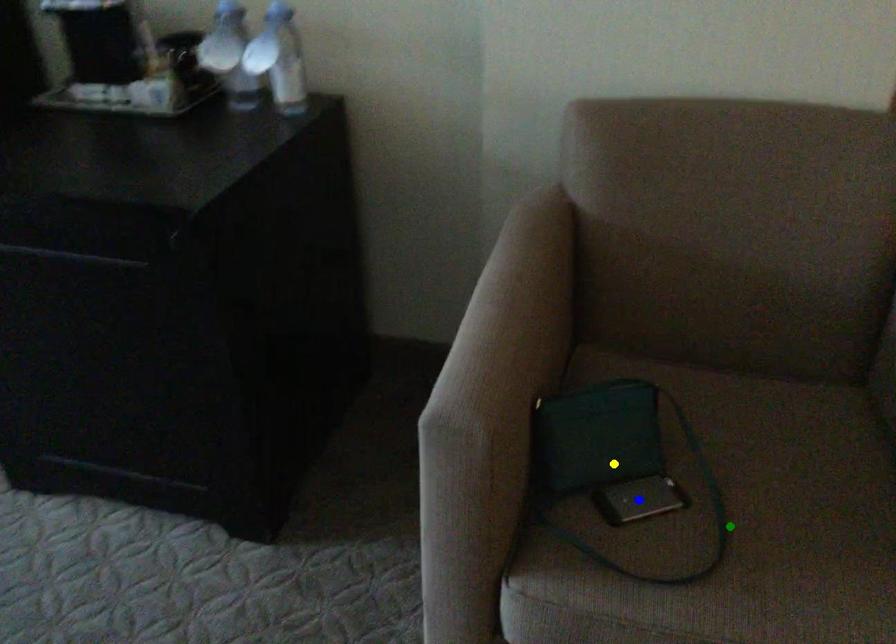
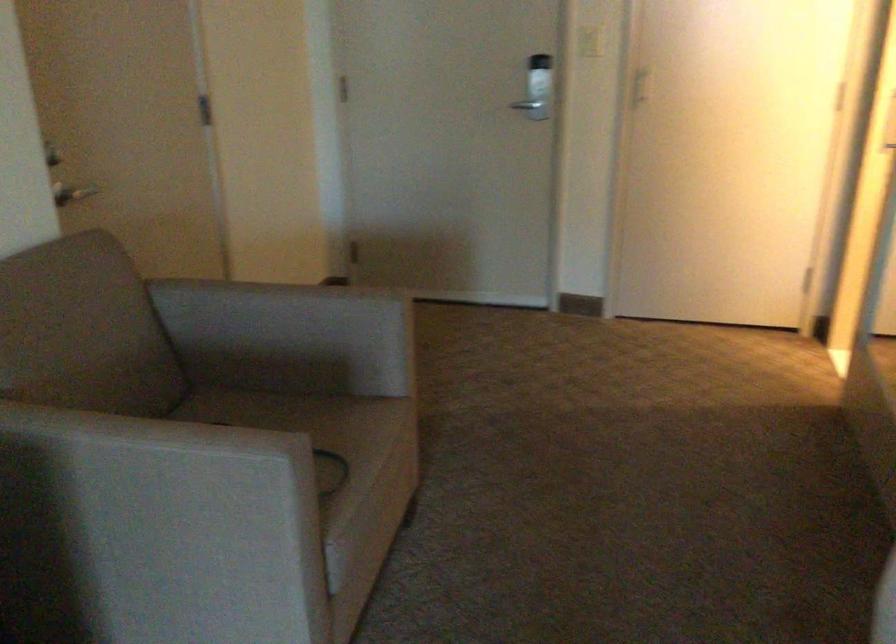
I am providing you with two images of the same scene from different viewpoints. Three points are marked in image1. Which point corresponds to a part or object that is occluded in image2?In image1, three points are marked. Which of them correspond to a part or object that is occluded in image2?Among the three points shown in image1, which one corresponds to a part or object that is no longer visible due to occlusion in image2?

green point, blue point, yellow point